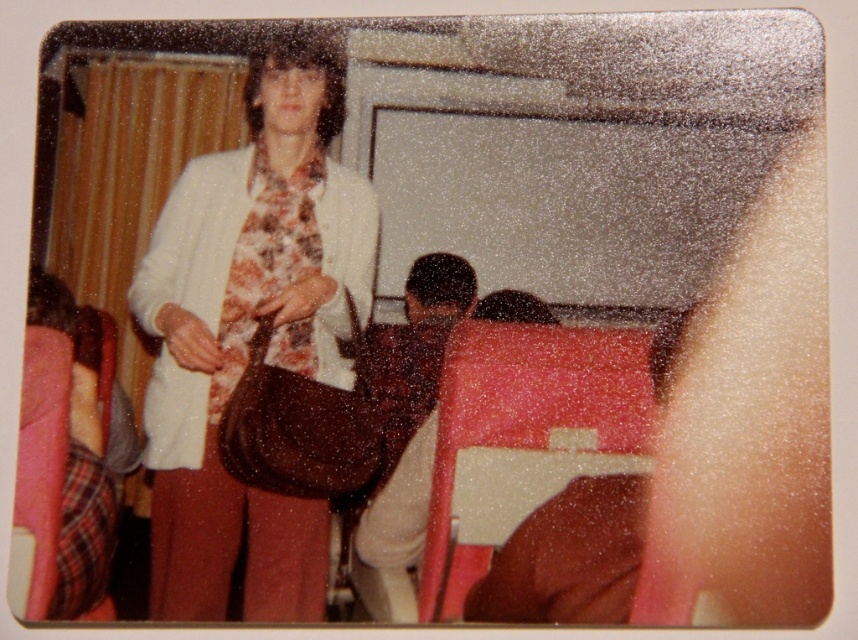
Who is lower down, smooth brown leather bag at lower right or floral fabric tie at center?

smooth brown leather bag at lower right is below.

The height and width of the screenshot is (640, 858). Identify the location of smooth brown leather bag at lower right. (569, 557).

The height and width of the screenshot is (640, 858). Describe the element at coordinates (569, 557) in the screenshot. I see `smooth brown leather bag at lower right` at that location.

Find the location of a particular element. The width and height of the screenshot is (858, 640). smooth brown leather bag at lower right is located at coordinates (569, 557).

Is matte brown purse at center further to camera compared to smooth brown leather bag at lower right?

Yes, it is behind smooth brown leather bag at lower right.

Does point (282, 209) come farther from viewer compared to point (535, 561)?

That is True.

The image size is (858, 640). What do you see at coordinates (251, 333) in the screenshot? I see `matte brown purse at center` at bounding box center [251, 333].

I want to click on matte brown purse at center, so click(x=251, y=333).

Is point (162, 582) farther from camera compared to point (252, 285)?

No, (162, 582) is in front of (252, 285).

Who is taller, matte brown purse at center or floral fabric tie at center?

matte brown purse at center is taller.

Who is more distant from viewer, (313,132) or (299,364)?

Positioned behind is point (299,364).

The image size is (858, 640). I want to click on matte brown purse at center, so click(x=251, y=333).